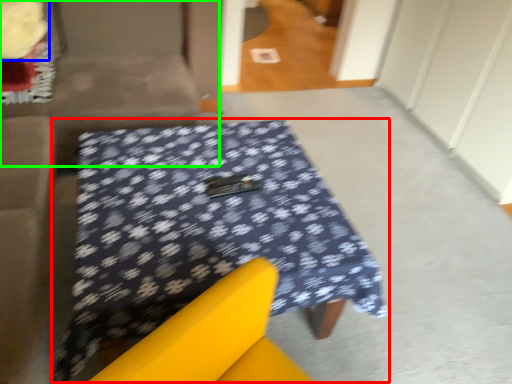
Question: Which object is positioned farthest from table (highlighted by a red box)? Select from flower (highlighted by a blue box) and couch (highlighted by a green box).

Choices:
 (A) flower
 (B) couch

Answer: (A)